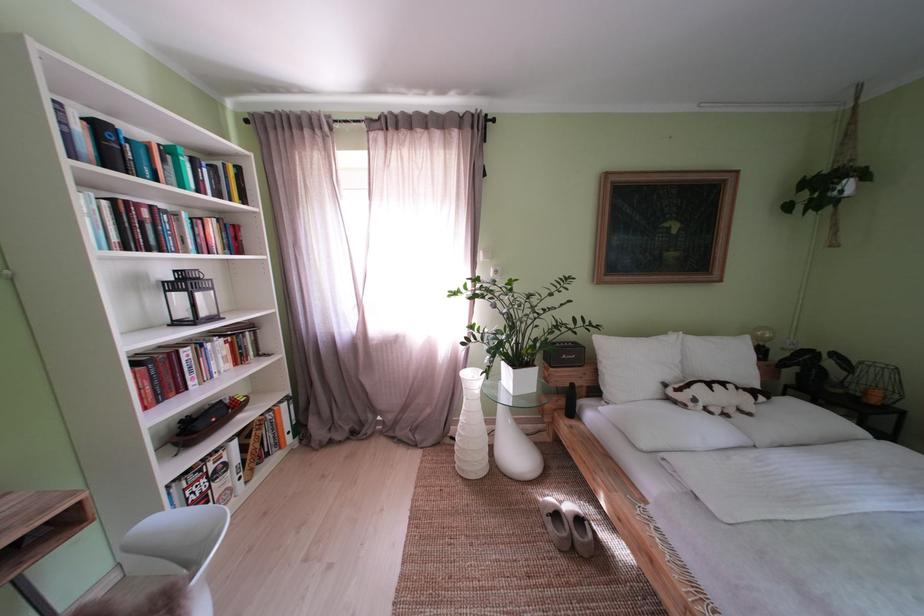
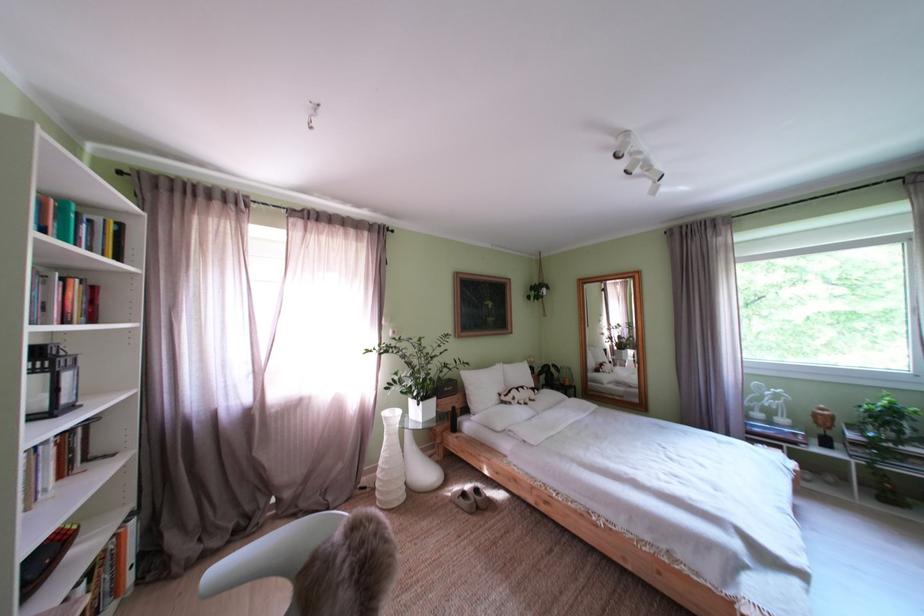
Locate, in the second image, the point that corresponds to pixel 528 461 in the first image.

(438, 479)